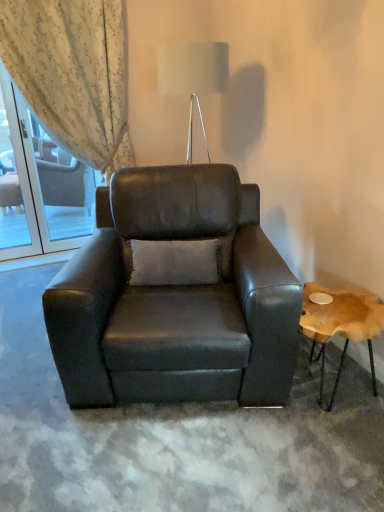
Question: Considering the relative positions of clear glass screen door at upper left and light beige textured curtain at upper left in the image provided, is clear glass screen door at upper left to the right of light beige textured curtain at upper left from the viewer's perspective?

Choices:
 (A) no
 (B) yes

Answer: (A)

Question: From the image's perspective, is clear glass screen door at upper left beneath light beige textured curtain at upper left?

Choices:
 (A) no
 (B) yes

Answer: (B)

Question: Is the position of clear glass screen door at upper left less distant than that of light beige textured curtain at upper left?

Choices:
 (A) yes
 (B) no

Answer: (B)

Question: Is clear glass screen door at upper left bigger than light beige textured curtain at upper left?

Choices:
 (A) no
 (B) yes

Answer: (A)

Question: Could you tell me if clear glass screen door at upper left is turned towards light beige textured curtain at upper left?

Choices:
 (A) yes
 (B) no

Answer: (A)

Question: Considering the positions of clear glass screen door at upper left and light beige textured curtain at upper left in the image, is clear glass screen door at upper left wider or thinner than light beige textured curtain at upper left?

Choices:
 (A) wide
 (B) thin

Answer: (B)

Question: Relative to light beige textured curtain at upper left, is clear glass screen door at upper left in front or behind?

Choices:
 (A) behind
 (B) front

Answer: (A)

Question: From the image's perspective, is clear glass screen door at upper left positioned above or below light beige textured curtain at upper left?

Choices:
 (A) below
 (B) above

Answer: (A)

Question: From their relative heights in the image, would you say clear glass screen door at upper left is taller or shorter than light beige textured curtain at upper left?

Choices:
 (A) tall
 (B) short

Answer: (B)

Question: From a real-world perspective, is metallic silver table lamp at upper center positioned above or below matte black armchair at center?

Choices:
 (A) above
 (B) below

Answer: (A)

Question: Does point (218, 91) appear closer or farther from the camera than point (249, 338)?

Choices:
 (A) farther
 (B) closer

Answer: (A)

Question: From the image's perspective, is metallic silver table lamp at upper center positioned above or below matte black armchair at center?

Choices:
 (A) below
 (B) above

Answer: (B)

Question: In terms of size, does metallic silver table lamp at upper center appear bigger or smaller than matte black armchair at center?

Choices:
 (A) small
 (B) big

Answer: (A)

Question: From a real-world perspective, is light beige textured curtain at upper left above or below metallic silver table lamp at upper center?

Choices:
 (A) below
 (B) above

Answer: (A)

Question: Relative to metallic silver table lamp at upper center, is light beige textured curtain at upper left in front or behind?

Choices:
 (A) behind
 (B) front

Answer: (A)